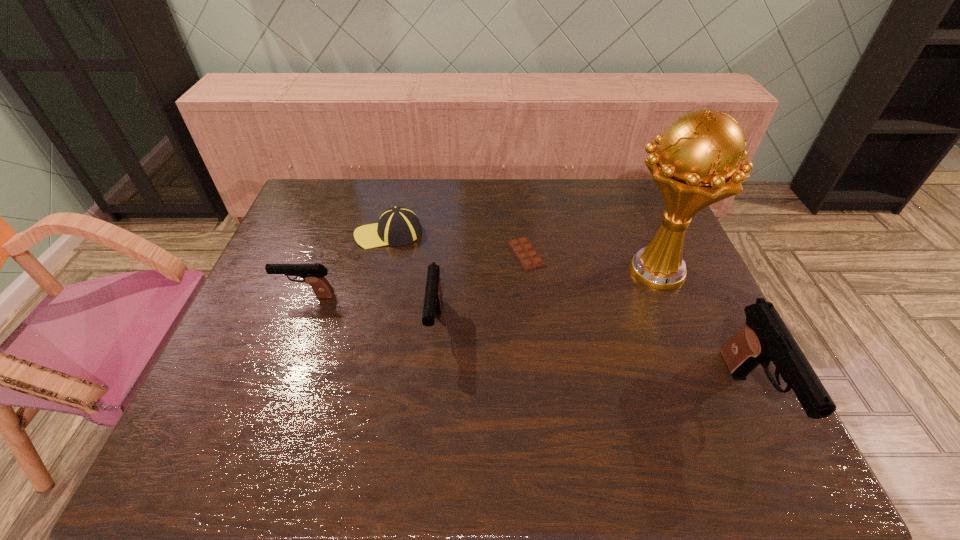
In order to click on vacant space at the left edge of the desktop in this screenshot , I will do `click(317, 221)`.

This screenshot has width=960, height=540. I want to click on free space at the right edge of the desktop, so click(x=686, y=253).

In the image, there is a desktop. Identify the location of vacant space at the far left corner. This screenshot has width=960, height=540. (341, 204).

At what (x,y) coordinates should I click in order to perform the action: click on free spot between the baseball cap and the rightmost pistol. Please return your answer as a coordinate pair (x, y). Looking at the image, I should click on (569, 316).

You are a GUI agent. You are given a task and a screenshot of the screen. Output one action in this format:
    pyautogui.click(x=<x>, y=<y>)
    Task: Click on the free space that is in between the fourth shortest object and the shortest pistol
    
    Given the screenshot: What is the action you would take?
    pyautogui.click(x=372, y=311)

I want to click on vacant area that lies between the second shortest pistol and the trophy_cup, so click(x=545, y=298).

Where is `empty space between the trophy_cup and the fourth shortest object`? empty space between the trophy_cup and the fourth shortest object is located at coordinates (545, 298).

Locate an element on the screen. free space between the trophy_cup and the leftmost pistol is located at coordinates (481, 284).

Find the location of a particular element. vacant point located between the tallest object and the shortest object is located at coordinates (590, 262).

Locate an element on the screen. The height and width of the screenshot is (540, 960). empty location between the shortest pistol and the second pistol from left to right is located at coordinates (372, 311).